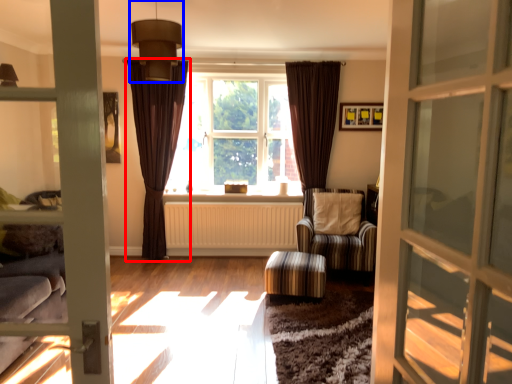
Question: Which object appears closest to the camera in this image, curtain (highlighted by a red box) or light fixture (highlighted by a blue box)?

Choices:
 (A) curtain
 (B) light fixture

Answer: (B)